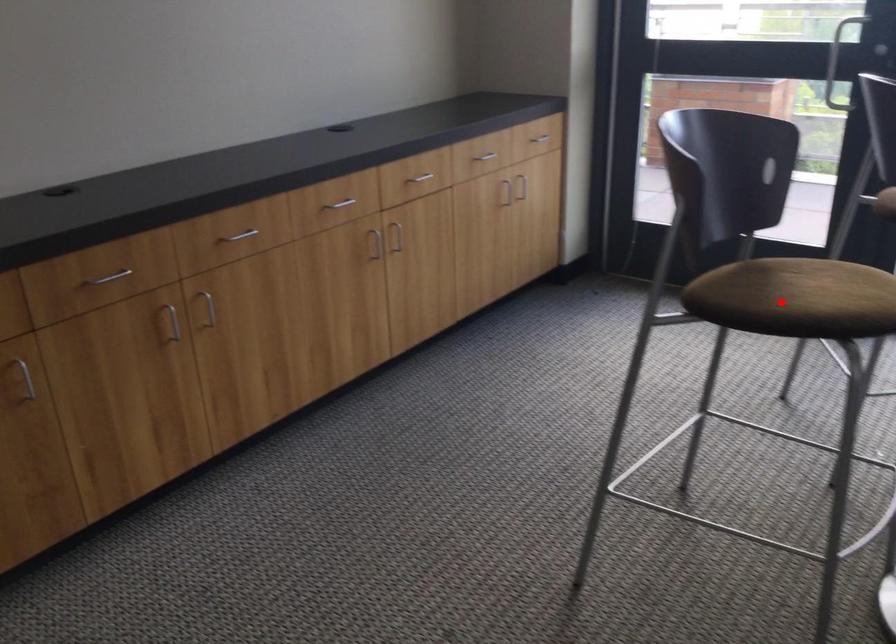
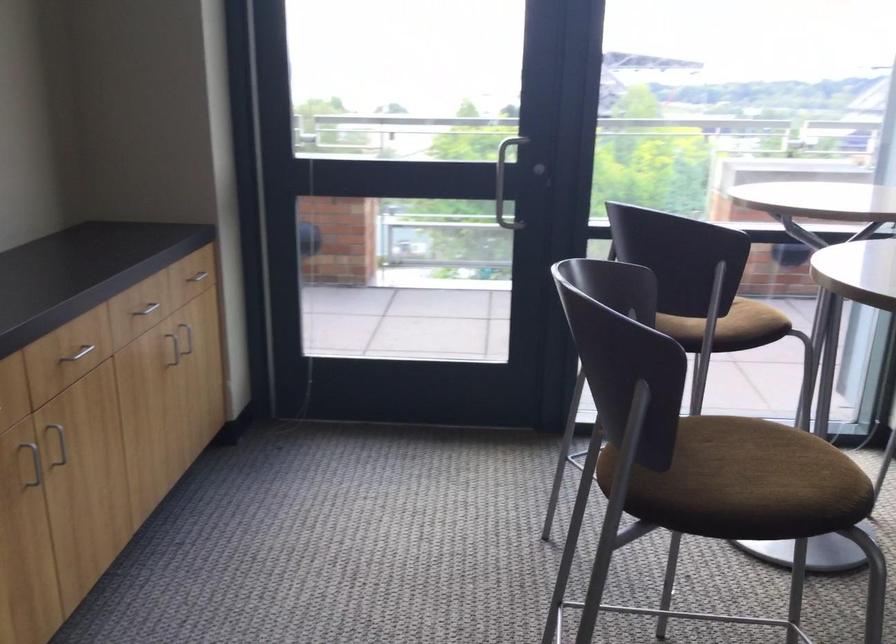
Question: I am providing you with two images of the same scene from different viewpoints. A red point is shown in image1. For the corresponding object point in image2, is it positioned nearer or farther from the camera?

Choices:
 (A) Nearer
 (B) Farther

Answer: (A)